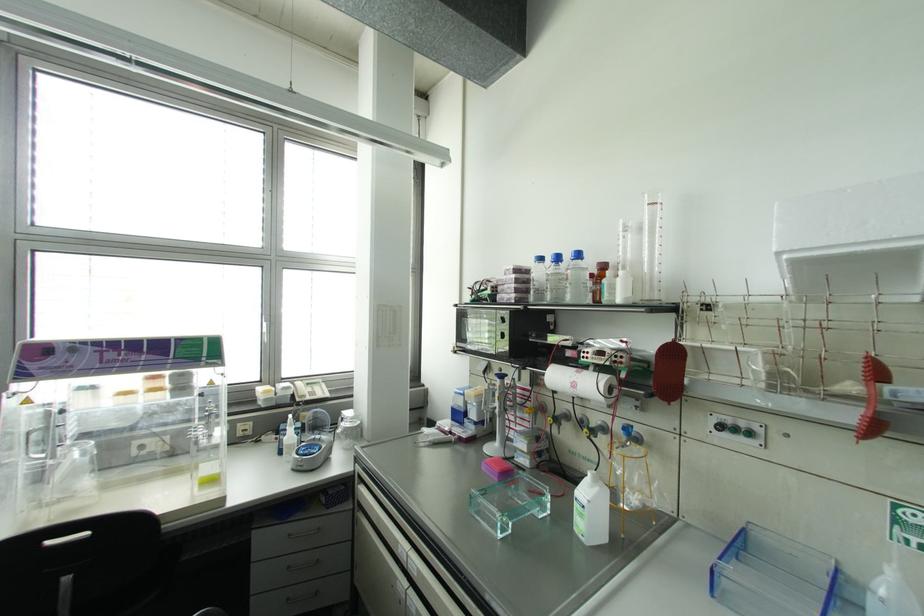
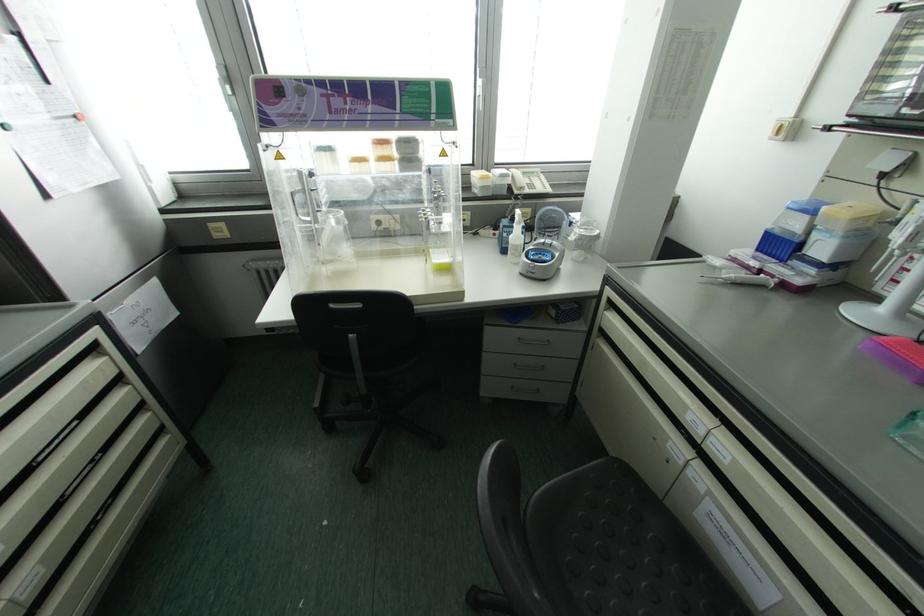
Where in the second image is the point corresponding to point (74, 472) from the first image?

(334, 238)